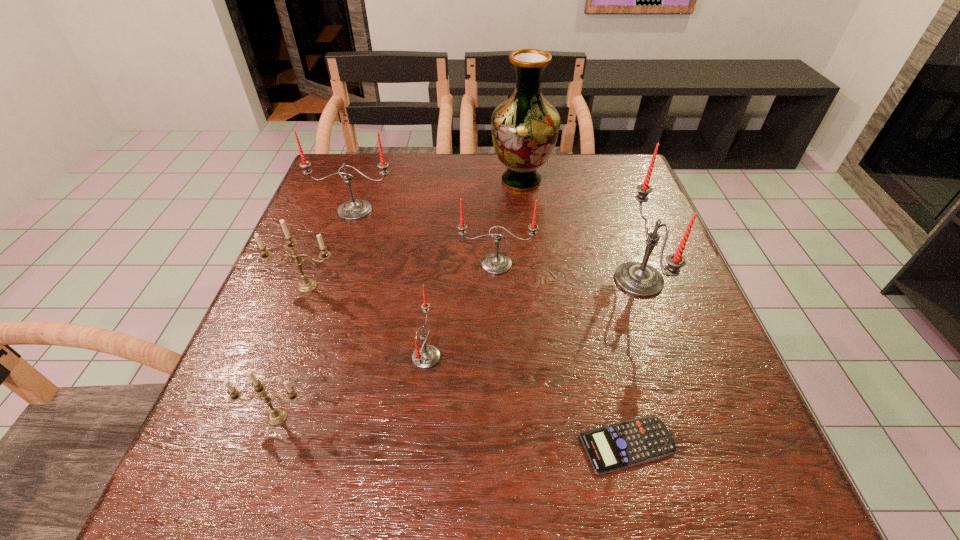
Locate which red candle is the second closest to the fourth candle from left to right. Please provide its 2D coordinates. Your answer should be formatted as a tuple, i.e. [(x, y)], where the tuple contains the x and y coordinates of a point satisfying the conditions above.

[(354, 209)]

Identify the location of red candle identified as the third closest to the blue calculator. The height and width of the screenshot is (540, 960). (496, 263).

Find the location of a particular element. The height and width of the screenshot is (540, 960). free spot that satisfies the following two spatial constraints: 1. on the front-facing side of the farthest candle; 2. on the right side of the calculator is located at coordinates (276, 445).

Locate an element on the screen. Image resolution: width=960 pixels, height=540 pixels. free location that satisfies the following two spatial constraints: 1. on the front-facing side of the blue calculator; 2. on the left side of the sixth farthest object is located at coordinates (417, 445).